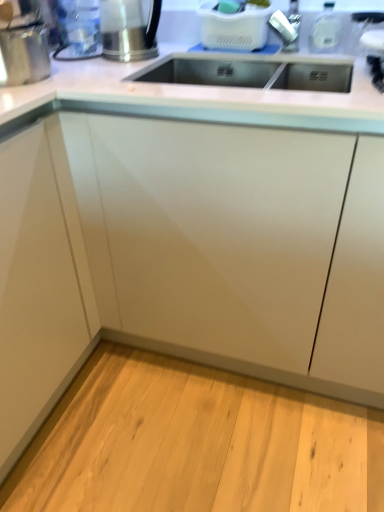
Question: In which direction should I rotate to look at white plastic basket at upper center, acting as the 4th appliance starting from the left?

Choices:
 (A) left
 (B) right

Answer: (B)

Question: Does white plastic basket at upper center, the first appliance viewed from the right, come in front of clear plastic water bottle at upper left, which is the 2th appliance from left to right?

Choices:
 (A) no
 (B) yes

Answer: (A)

Question: From a real-world perspective, is white plastic basket at upper center, acting as the 4th appliance starting from the left, on clear plastic water bottle at upper left, which is the 2th appliance from left to right?

Choices:
 (A) no
 (B) yes

Answer: (A)

Question: Could clear plastic water bottle at upper left, which is the 2th appliance from left to right, be considered to be inside white plastic basket at upper center, the first appliance viewed from the right?

Choices:
 (A) yes
 (B) no

Answer: (B)

Question: Is white plastic basket at upper center, acting as the 4th appliance starting from the left, positioned beyond the bounds of clear plastic water bottle at upper left, which is the 2th appliance from left to right?

Choices:
 (A) no
 (B) yes

Answer: (B)

Question: Considering the relative sizes of white plastic basket at upper center, acting as the 4th appliance starting from the left, and clear plastic water bottle at upper left, which is the 2th appliance from left to right, in the image provided, is white plastic basket at upper center, acting as the 4th appliance starting from the left, bigger than clear plastic water bottle at upper left, which is the 2th appliance from left to right,?

Choices:
 (A) yes
 (B) no

Answer: (A)

Question: Can you confirm if white plastic basket at upper center, the first appliance viewed from the right, is thinner than clear plastic water bottle at upper left, which is the 2th appliance from left to right?

Choices:
 (A) no
 (B) yes

Answer: (A)

Question: Does brushed metal kettle at upper left, marked as the 3th appliance in a left-to-right arrangement, have a lesser height compared to shiny metallic kettle at upper left, the 4th appliance viewed from the right?

Choices:
 (A) yes
 (B) no

Answer: (B)

Question: Is brushed metal kettle at upper left, which is counted as the second appliance, starting from the right, far from shiny metallic kettle at upper left, the 4th appliance viewed from the right?

Choices:
 (A) no
 (B) yes

Answer: (A)

Question: Does brushed metal kettle at upper left, marked as the 3th appliance in a left-to-right arrangement, have a larger size compared to shiny metallic kettle at upper left, the 4th appliance viewed from the right?

Choices:
 (A) yes
 (B) no

Answer: (A)

Question: Can you confirm if brushed metal kettle at upper left, marked as the 3th appliance in a left-to-right arrangement, is positioned to the left of shiny metallic kettle at upper left, the 4th appliance viewed from the right?

Choices:
 (A) yes
 (B) no

Answer: (B)

Question: Is brushed metal kettle at upper left, marked as the 3th appliance in a left-to-right arrangement, wider than shiny metallic kettle at upper left, the 4th appliance viewed from the right?

Choices:
 (A) yes
 (B) no

Answer: (B)

Question: From a real-world perspective, is brushed metal kettle at upper left, marked as the 3th appliance in a left-to-right arrangement, under shiny metallic kettle at upper left, which appears as the 1th appliance when viewed from the left?

Choices:
 (A) yes
 (B) no

Answer: (B)

Question: From the image's perspective, would you say clear plastic water bottle at upper left, which ranks as the third appliance in right-to-left order, is shown under brushed metal kettle at upper left, which is counted as the second appliance, starting from the right?

Choices:
 (A) yes
 (B) no

Answer: (B)